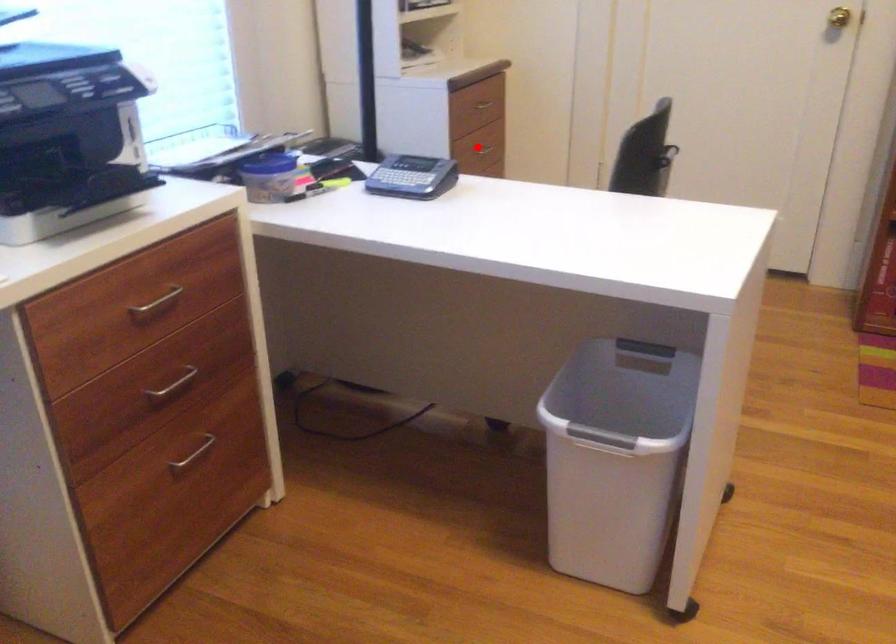
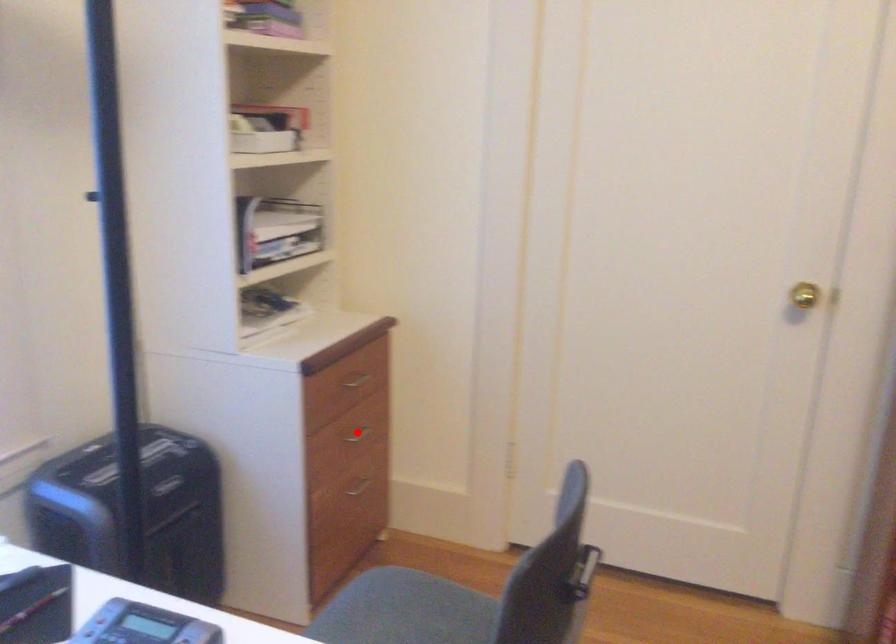
I am providing you with two images of the same scene from different viewpoints. A red point is marked on the first image and another point is marked on the second image. Are the points marked in image1 and image2 representing the same 3D position?

Yes